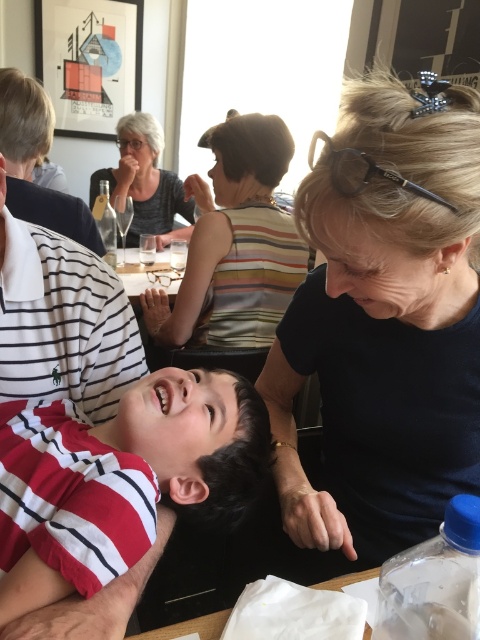
Question: Which object is farther from the camera taking this photo?

Choices:
 (A) white striped polo shirt at upper left
 (B) matte black jacket at upper left

Answer: (B)

Question: Is red striped shirt at lower left below white striped polo shirt at upper left?

Choices:
 (A) yes
 (B) no

Answer: (A)

Question: Which object appears farthest from the camera in this image?

Choices:
 (A) black matte hair at upper right
 (B) white striped polo shirt at upper left
 (C) red striped shirt at lower left

Answer: (B)

Question: Which of these objects is positioned closest to the gray textured shirt at upper left?

Choices:
 (A) white striped polo shirt at upper left
 (B) red striped shirt at lower left
 (C) matte black jacket at upper left

Answer: (C)

Question: Considering the relative positions of black matte hair at upper right and white striped polo shirt at upper left in the image provided, where is black matte hair at upper right located with respect to white striped polo shirt at upper left?

Choices:
 (A) left
 (B) right

Answer: (B)

Question: Can you confirm if matte black jacket at upper left is positioned to the left of gray textured shirt at upper left?

Choices:
 (A) no
 (B) yes

Answer: (B)